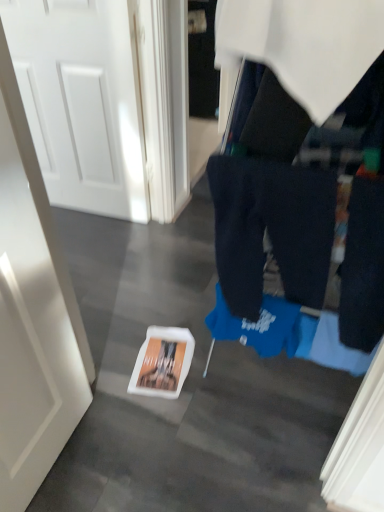
Question: Is dark blue cotton trousers at center oriented towards white glossy door at upper left, which is the 1th door in back-to-front order?

Choices:
 (A) yes
 (B) no

Answer: (B)

Question: Can you confirm if dark blue cotton trousers at center is thinner than white glossy door at upper left, the first door when ordered from top to bottom?

Choices:
 (A) no
 (B) yes

Answer: (A)

Question: Does dark blue cotton trousers at center have a lesser height compared to white glossy door at upper left, which is the second door from bottom to top?

Choices:
 (A) no
 (B) yes

Answer: (B)

Question: Does dark blue cotton trousers at center come behind white glossy door at upper left, which is the second door from bottom to top?

Choices:
 (A) yes
 (B) no

Answer: (B)

Question: Is dark blue cotton trousers at center wider than white glossy door at upper left, arranged as the second door when viewed from the front?

Choices:
 (A) yes
 (B) no

Answer: (A)

Question: Is dark blue cotton trousers at center surrounding white glossy door at upper left, the first door when ordered from top to bottom?

Choices:
 (A) yes
 (B) no

Answer: (B)

Question: Can you confirm if white glossy door at upper left, which is the second door from bottom to top, is wider than dark blue cotton trousers at center?

Choices:
 (A) no
 (B) yes

Answer: (A)

Question: Is white glossy door at upper left, arranged as the second door when viewed from the front, oriented towards dark blue cotton trousers at center?

Choices:
 (A) no
 (B) yes

Answer: (A)

Question: Is white glossy door at upper left, which is the second door from bottom to top, to the right of dark blue cotton trousers at center from the viewer's perspective?

Choices:
 (A) yes
 (B) no

Answer: (B)

Question: Is white glossy door at upper left, which is the 1th door in back-to-front order, turned away from dark blue cotton trousers at center?

Choices:
 (A) yes
 (B) no

Answer: (B)

Question: Is white glossy door at upper left, which is the second door from bottom to top, shorter than dark blue cotton trousers at center?

Choices:
 (A) no
 (B) yes

Answer: (A)

Question: Considering the relative sizes of white glossy door at upper left, the first door when ordered from top to bottom, and dark blue cotton trousers at center in the image provided, is white glossy door at upper left, the first door when ordered from top to bottom, bigger than dark blue cotton trousers at center?

Choices:
 (A) no
 (B) yes

Answer: (B)

Question: Does blue fabric at center have a larger size compared to white glossy door at left, the 2th door positioned from the top?

Choices:
 (A) no
 (B) yes

Answer: (B)